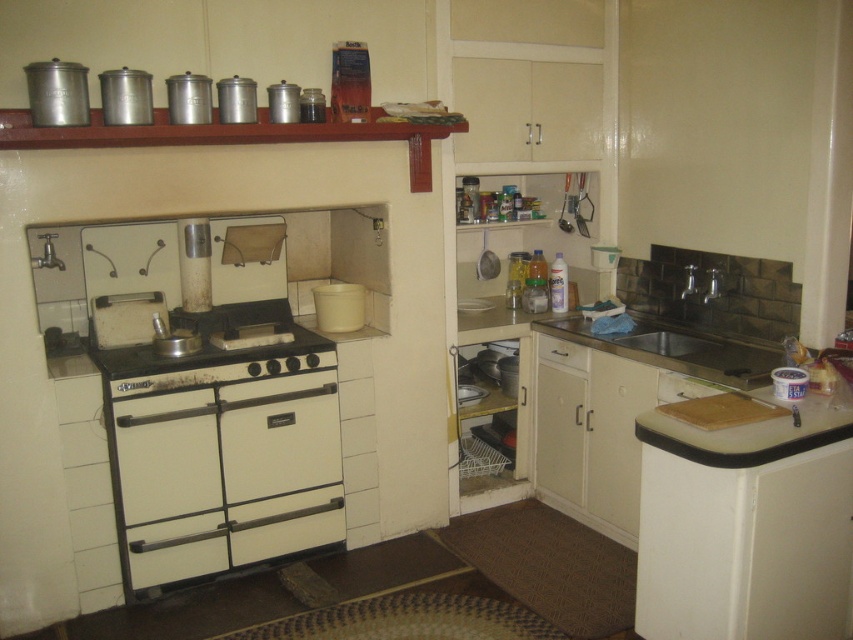
Does white matte gas stove at center have a larger size compared to white matte drawer at center?

Yes, white matte gas stove at center is bigger than white matte drawer at center.

Consider the image. Who is positioned more to the right, white matte gas stove at center or white matte drawer at center?

Positioned to the right is white matte drawer at center.

Identify the location of white matte gas stove at center. (218, 349).

Can you confirm if white matte gas stove at center is positioned below white laminate cutting board at lower right?

No.

Measure the distance between white matte gas stove at center and white laminate cutting board at lower right.

white matte gas stove at center is 5.06 feet from white laminate cutting board at lower right.

The height and width of the screenshot is (640, 853). Describe the element at coordinates (218, 349) in the screenshot. I see `white matte gas stove at center` at that location.

Image resolution: width=853 pixels, height=640 pixels. I want to click on white matte gas stove at center, so click(218, 349).

Does metallic silver canister at upper left have a smaller size compared to metallic silver exhaust hood at upper center?

Indeed, metallic silver canister at upper left has a smaller size compared to metallic silver exhaust hood at upper center.

Which is in front, point (39, 108) or point (215, 236)?

Point (39, 108)

Is point (70, 86) positioned behind point (242, 240)?

No, (70, 86) is closer to viewer.

Where is `metallic silver canister at upper left`? Image resolution: width=853 pixels, height=640 pixels. metallic silver canister at upper left is located at coordinates (57, 93).